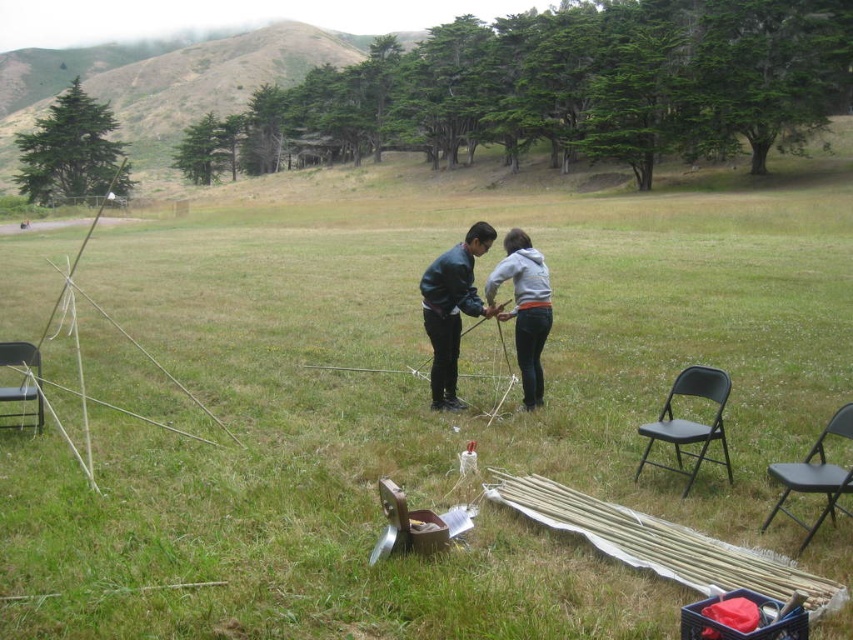
Question: Does gray fleece hoodie at center have a smaller size compared to black plastic chair at right?

Choices:
 (A) yes
 (B) no

Answer: (A)

Question: Which object appears closest to the camera in this image?

Choices:
 (A) black metal chair at left
 (B) gray fleece hoodie at center

Answer: (A)

Question: Can you confirm if black plastic chair at right is positioned to the right of black metal chair at left?

Choices:
 (A) yes
 (B) no

Answer: (A)

Question: From the image, what is the correct spatial relationship of black plastic chair at right in relation to black metal chair at left?

Choices:
 (A) below
 (B) above

Answer: (A)

Question: Among these objects, which one is farthest from the camera?

Choices:
 (A) matte black jacket at center
 (B) black plastic chair at lower right

Answer: (A)

Question: Which of the following is the closest to the observer?

Choices:
 (A) black metal chair at left
 (B) black plastic chair at right
 (C) matte black jacket at center
 (D) black plastic chair at lower right

Answer: (D)